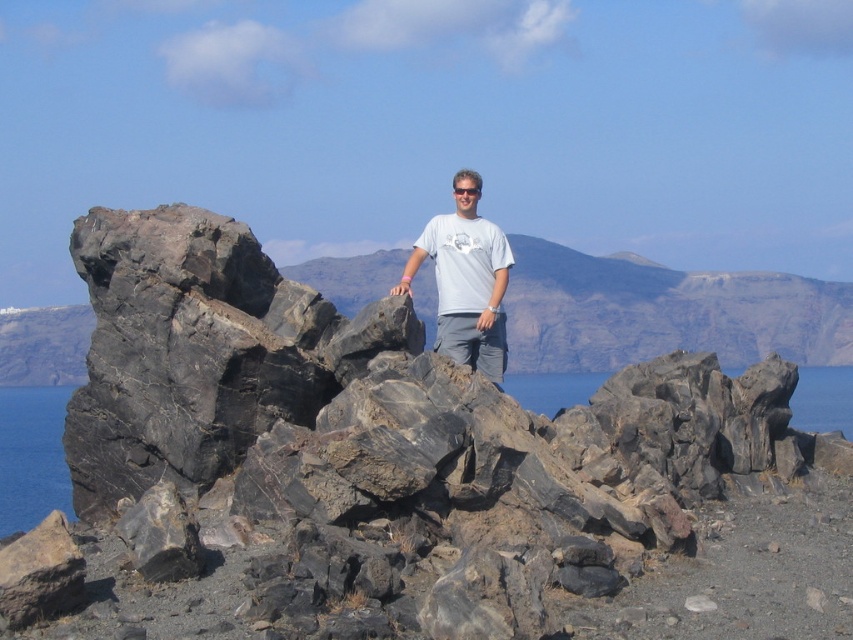
Question: Which point is closer to the camera?

Choices:
 (A) (827, 385)
 (B) (396, 284)
 (C) (39, 477)
 (D) (685, 378)

Answer: (D)

Question: Is white matte t-shirt at center to the right of transparent water at rock right from the viewer's perspective?

Choices:
 (A) yes
 (B) no

Answer: (B)

Question: Which point is farther to the camera?

Choices:
 (A) black volcanic rock at center
 (B) black rock at center
 (C) transparent water at rock right

Answer: (B)

Question: Is black rock at center wider than transparent water at rock right?

Choices:
 (A) no
 (B) yes

Answer: (B)

Question: Which object appears closest to the camera in this image?

Choices:
 (A) black volcanic rock at center
 (B) transparent water at rock right

Answer: (A)

Question: Can you confirm if white matte t-shirt at center is positioned to the left of transparent water at rock right?

Choices:
 (A) yes
 (B) no

Answer: (A)